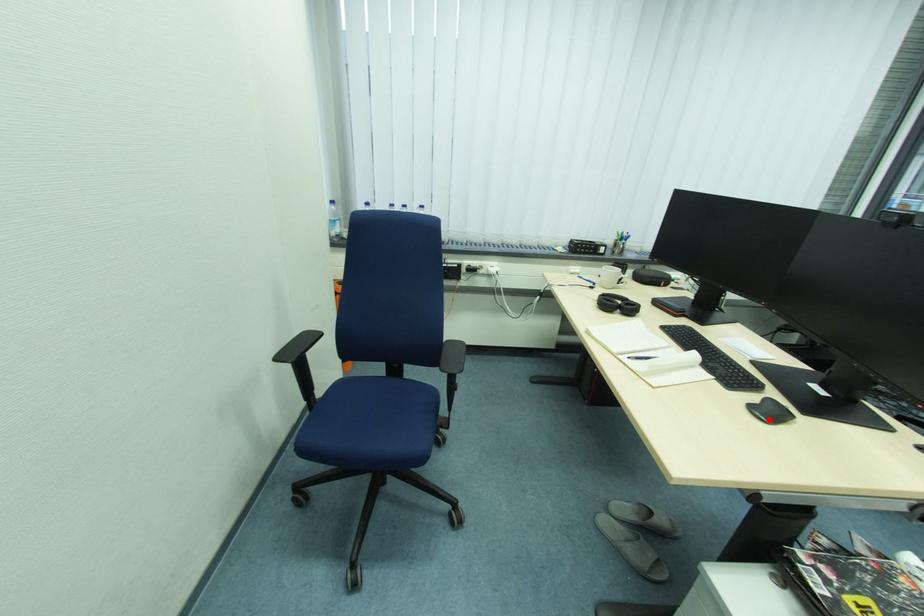
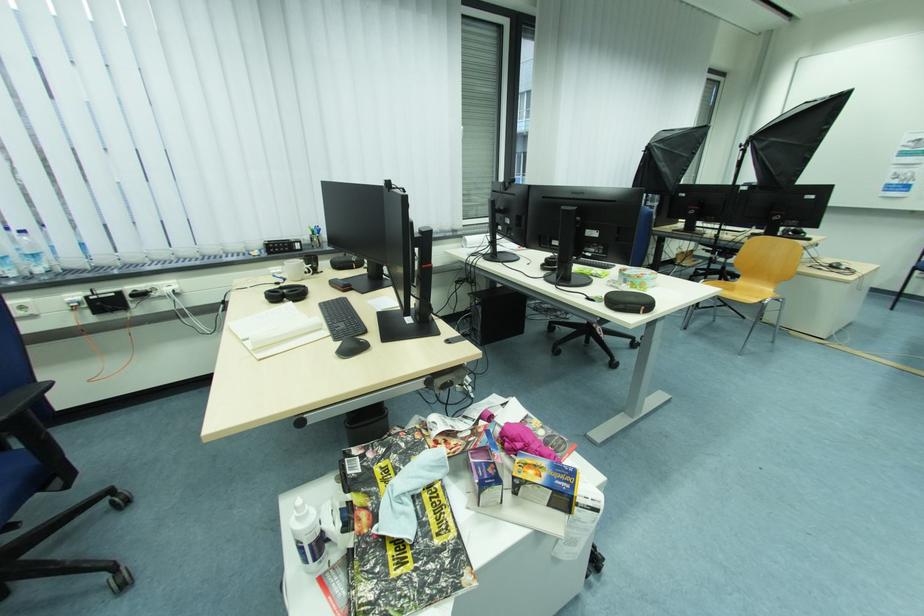
Where in the second image is the point corresponding to the highlighted location from the first image?

(348, 357)